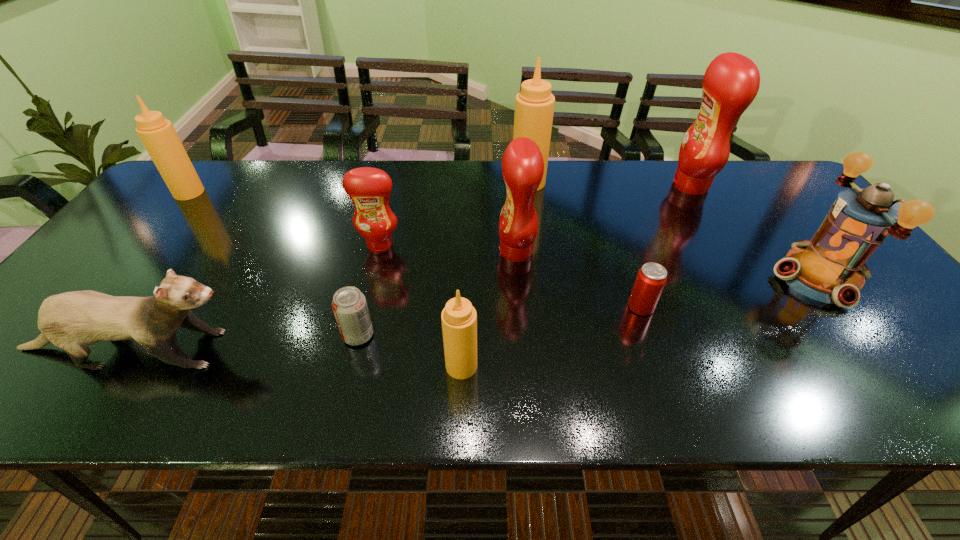
Image resolution: width=960 pixels, height=540 pixels. I want to click on the second object from right to left, so click(x=731, y=82).

The height and width of the screenshot is (540, 960). What are the coordinates of `the rightmost red condiment` in the screenshot? It's located at (731, 82).

You are a GUI agent. You are given a task and a screenshot of the screen. Output one action in this format:
    pyautogui.click(x=<x>, y=<y>)
    Task: Click on the biggest tan condiment
    Image resolution: width=960 pixels, height=540 pixels.
    Given the screenshot: What is the action you would take?
    coord(534,105)

Locate an element on the screen. The image size is (960, 540). the second smallest tan condiment is located at coordinates [x=158, y=135].

Where is `the leftmost condiment`? This screenshot has width=960, height=540. the leftmost condiment is located at coordinates (158, 135).

You are a GUI agent. You are given a task and a screenshot of the screen. Output one action in this format:
    pyautogui.click(x=<x>, y=<y>)
    Task: Click on the second biggest red condiment
    
    Given the screenshot: What is the action you would take?
    click(x=522, y=164)

The height and width of the screenshot is (540, 960). What are the coordinates of `the rightmost object` in the screenshot? It's located at pos(830,268).

This screenshot has height=540, width=960. In order to click on the smallest red condiment in this screenshot , I will do `click(369, 188)`.

Locate an element on the screen. the second condiment from left to right is located at coordinates (369, 188).

Identify the location of the fifth object from left to right. (459, 318).